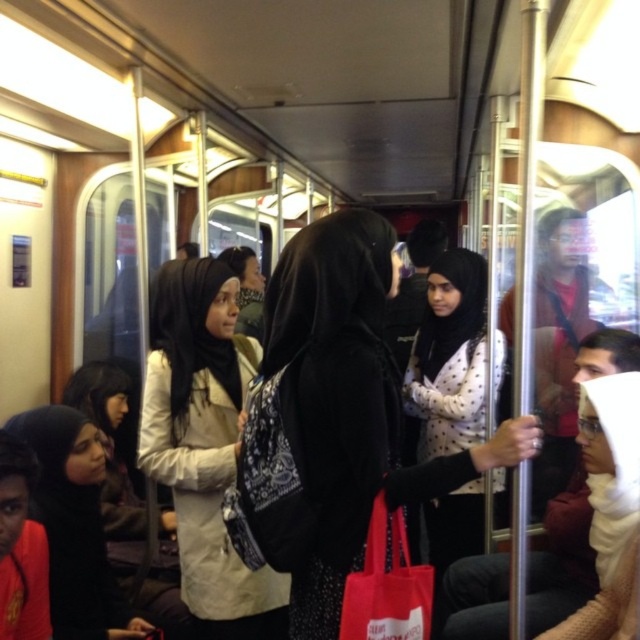
Can you confirm if white dotted shirt at center is positioned to the left of black fabric hijab at lower left?

No, white dotted shirt at center is not to the left of black fabric hijab at lower left.

Does point (436, 435) lie in front of point (70, 426)?

That is False.

Does point (442, 548) lie in front of point (68, 474)?

No, (442, 548) is further to viewer.

Find the location of `white dotted shirt at center`. white dotted shirt at center is located at coordinates (449, 356).

What do you see at coordinates (204, 444) in the screenshot? This screenshot has height=640, width=640. I see `beige fabric hijab at center` at bounding box center [204, 444].

Which is in front, point (189, 348) or point (451, 365)?

Positioned in front is point (189, 348).

The height and width of the screenshot is (640, 640). In order to click on beige fabric hijab at center in this screenshot , I will do `click(204, 444)`.

Consider the image. Does beige fabric hijab at center have a lesser width compared to black fabric hijab at lower left?

Incorrect, beige fabric hijab at center's width is not less than black fabric hijab at lower left's.

Is beige fabric hijab at center to the left of black fabric hijab at lower left from the viewer's perspective?

In fact, beige fabric hijab at center is to the right of black fabric hijab at lower left.

Is point (214, 497) positioned after point (58, 536)?

That is False.

What are the coordinates of `beige fabric hijab at center` in the screenshot? It's located at (204, 444).